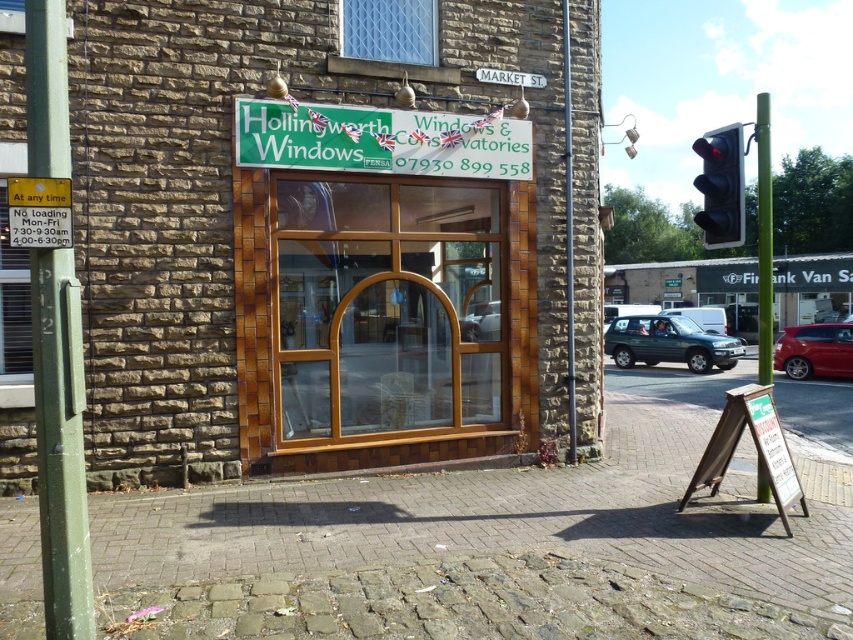
Question: Can you confirm if wooden window at center is positioned to the right of white plastic street sign at upper center?

Choices:
 (A) no
 (B) yes

Answer: (A)

Question: Is green plastic signboard at upper center positioned at the back of metallic pole at center?

Choices:
 (A) yes
 (B) no

Answer: (B)

Question: Which of these objects is positioned farthest from the metallic traffic light at upper right?

Choices:
 (A) white plastic street sign at upper center
 (B) green painted metal pole at left

Answer: (B)

Question: Which point appears closest to the camera in this image?

Choices:
 (A) (67, 113)
 (B) (529, 388)
 (C) (769, 140)
 (D) (512, 138)

Answer: (A)

Question: Among these objects, which one is nearest to the camera?

Choices:
 (A) green metallic pole at right
 (B) green metallic suv at center
 (C) green painted metal pole at left
 (D) green plastic signboard at upper center

Answer: (C)

Question: Is green plastic signboard at upper center positioned at the back of metallic traffic light at upper right?

Choices:
 (A) no
 (B) yes

Answer: (B)